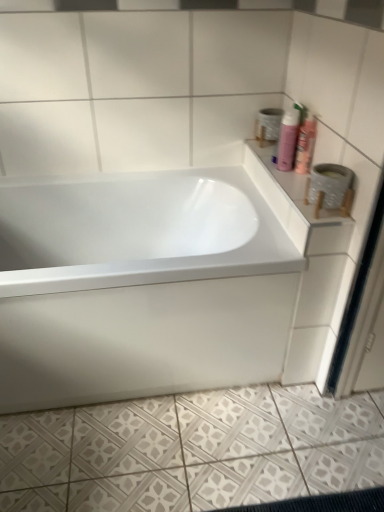
Question: Is white textured tile at lower center inside the boundaries of white glossy counter top at upper right, or outside?

Choices:
 (A) outside
 (B) inside

Answer: (A)

Question: Is white textured tile at lower center to the left or to the right of white glossy counter top at upper right in the image?

Choices:
 (A) left
 (B) right

Answer: (A)

Question: Considering the real-world distances, which object is farthest from the pink matte shaving cream at upper right, the 1th shaving cream in the left-to-right sequence?

Choices:
 (A) white glossy bathtub at center
 (B) white glossy counter top at upper right
 (C) pink matte shaving cream at upper right, which appears as the 2th shaving cream when viewed from the left
 (D) white textured tile at lower center
 (E) white textured toilet paper at upper right

Answer: (D)

Question: Considering the real-world distances, which object is closest to the white textured tile at lower center?

Choices:
 (A) white glossy counter top at upper right
 (B) white glossy bathtub at center
 (C) pink matte shaving cream at upper right, which appears as the 2th shaving cream when viewed from the left
 (D) white textured toilet paper at upper right
 (E) pink matte shaving cream at upper right, the 1th shaving cream in the left-to-right sequence

Answer: (B)